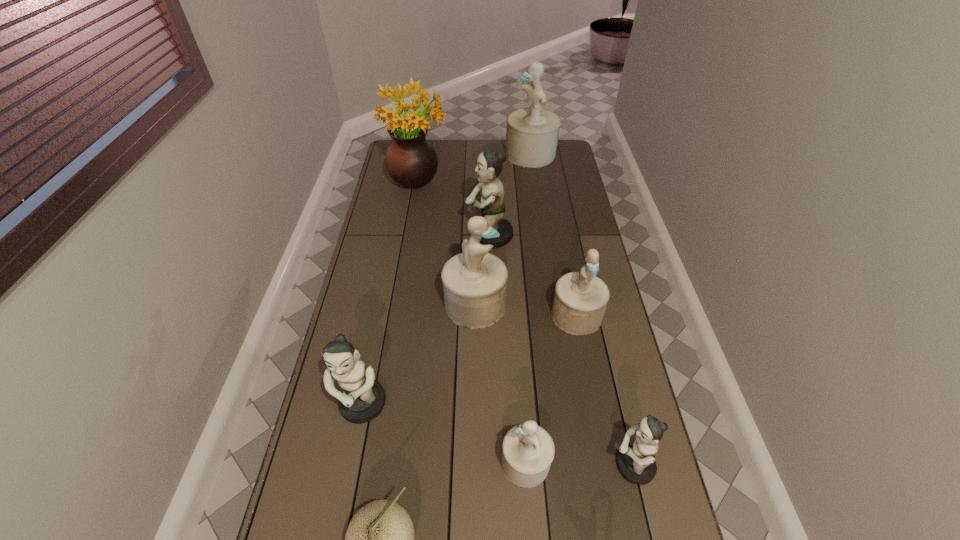
I want to click on blank area located on the front-facing side of the fifth farthest figurine, so 343,506.

This screenshot has height=540, width=960. What are the coordinates of `free spot located at the beak of the third biggest white figurine` in the screenshot? It's located at (591, 390).

I want to click on free space located 0.250m at the beak of the nearest white figurine, so click(405, 462).

The height and width of the screenshot is (540, 960). What are the coordinates of `free space located 0.340m at the beak of the nearest white figurine` in the screenshot? It's located at (372, 462).

The height and width of the screenshot is (540, 960). In order to click on vacant space situated 0.320m at the beak of the nearest white figurine in this screenshot , I will do `click(379, 462)`.

Where is `vacant space located 0.390m on the front-facing side of the nearest green figurine`? Image resolution: width=960 pixels, height=540 pixels. vacant space located 0.390m on the front-facing side of the nearest green figurine is located at coordinates (461, 466).

This screenshot has width=960, height=540. In order to click on vacant position located on the front-facing side of the nearest green figurine in this screenshot , I will do `click(499, 466)`.

Where is `free spot located on the front-facing side of the nearest green figurine`? This screenshot has height=540, width=960. free spot located on the front-facing side of the nearest green figurine is located at coordinates (526, 466).

You are a GUI agent. You are given a task and a screenshot of the screen. Output one action in this format:
    pyautogui.click(x=<x>, y=<y>)
    Task: Click on the figurine situated at the far edge
    This screenshot has width=960, height=540.
    Given the screenshot: What is the action you would take?
    pyautogui.click(x=532, y=133)

Where is `flower arrangement situated at the far edge`? The width and height of the screenshot is (960, 540). flower arrangement situated at the far edge is located at coordinates (411, 161).